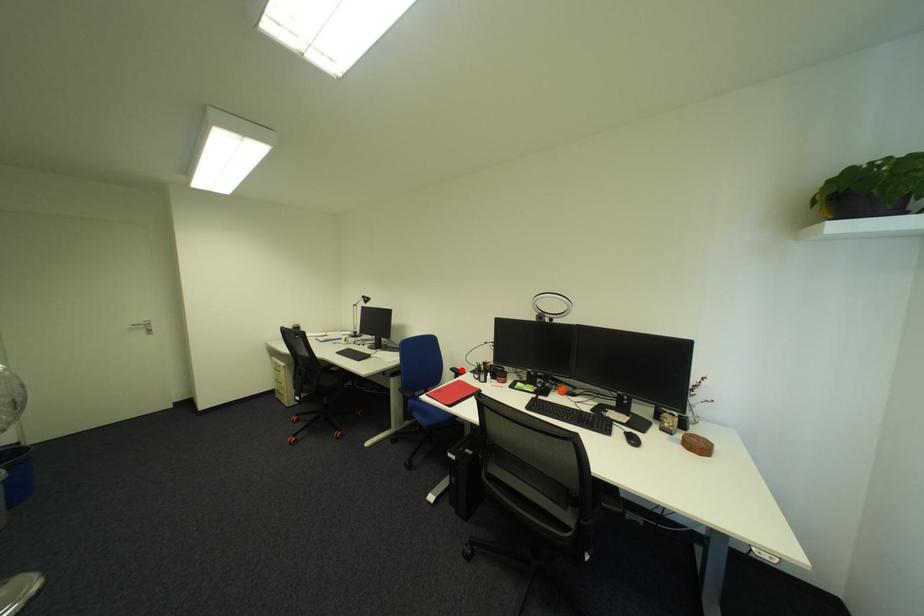
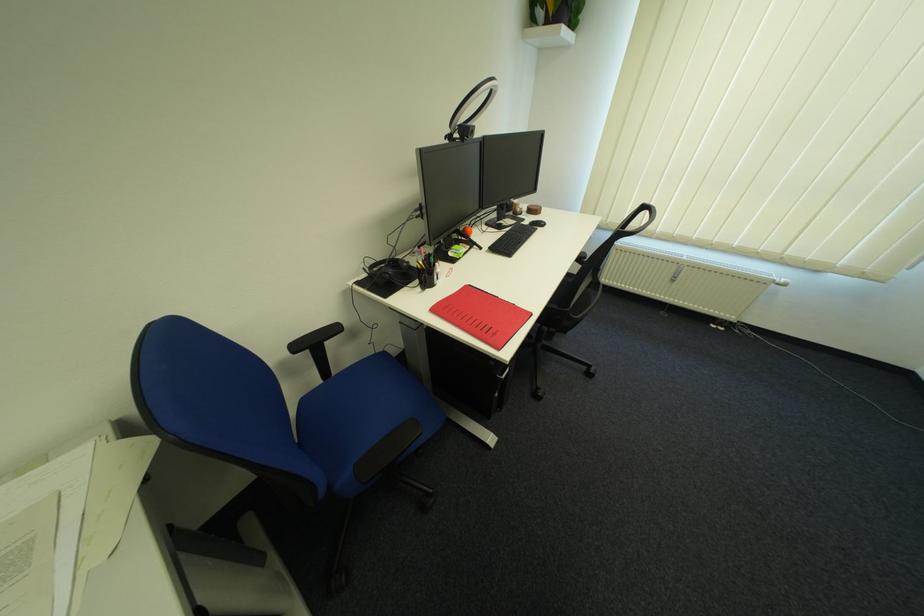
Find the pixel in the second image that matches the highlighted location in the first image.

(306, 349)